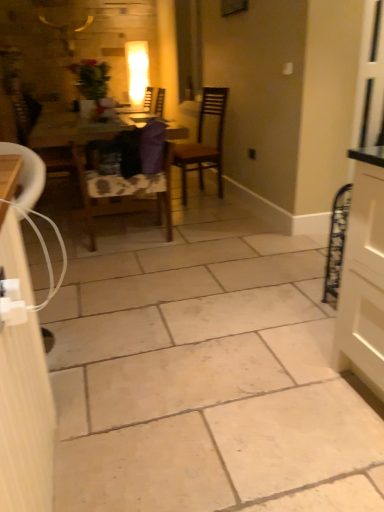
Locate an element on the screen. The image size is (384, 512). free point below wooden chair at center, which is the 2th chair from left to right (from a real-world perspective) is located at coordinates (127, 238).